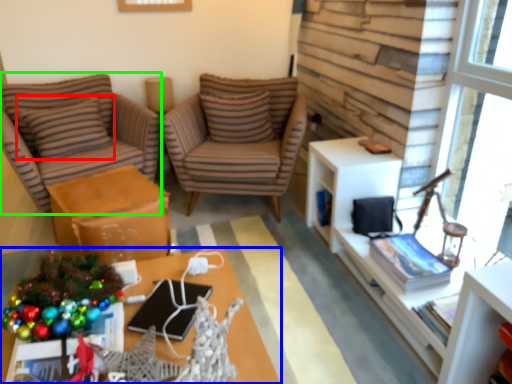
Question: Based on their relative distances, which object is nearer to pillow (highlighted by a red box)? Choose from desk (highlighted by a blue box) and chair (highlighted by a green box).

Choices:
 (A) desk
 (B) chair

Answer: (B)